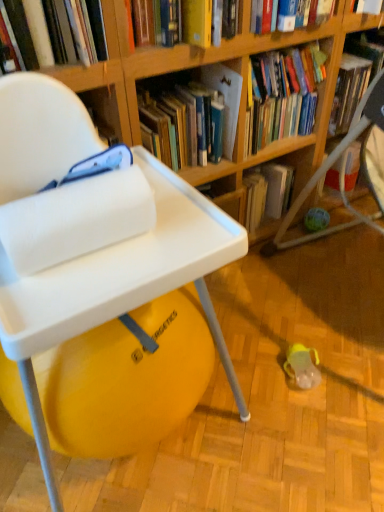
You are a GUI agent. You are given a task and a screenshot of the screen. Output one action in this format:
    pyautogui.click(x=<x>, y=<y>)
    Task: Click on the wooden bookshelf at center, which appears as the second shelf when viewed from the front
    
    Given the screenshot: What is the action you would take?
    pyautogui.click(x=278, y=189)

I want to click on hardcover book at upper center, arranged as the first book when viewed from the right, so click(x=205, y=22).

Describe the element at coordinates (155, 72) in the screenshot. This screenshot has width=384, height=512. I see `wooden bookshelf at upper center, the 2th shelf when ordered from right to left` at that location.

Locate an element on the screen. The width and height of the screenshot is (384, 512). wooden bookshelf at center, the 1th shelf viewed from the back is located at coordinates (278, 189).

Does hardcover book at upper left, which appears as the 3th book when viewed from the right, have a lesser width compared to wooden bookshelf at upper center, the 1th shelf positioned from the front?

In fact, hardcover book at upper left, which appears as the 3th book when viewed from the right, might be wider than wooden bookshelf at upper center, the 1th shelf positioned from the front.

Which object is closer to the camera, hardcover book at upper left, which appears as the 3th book when viewed from the right, or wooden bookshelf at upper center, positioned as the 2th shelf in back-to-front order?

hardcover book at upper left, which appears as the 3th book when viewed from the right, is in front.

Are hardcover book at upper left, which appears as the 3th book when viewed from the right, and wooden bookshelf at upper center, the first shelf viewed from the left, far apart?

No, hardcover book at upper left, which appears as the 3th book when viewed from the right, is in close proximity to wooden bookshelf at upper center, the first shelf viewed from the left.

Is point (99, 23) more distant than point (133, 106)?

No, it is not.

Which object is positioned more to the right, hardcover book at upper center, marked as the 2th book in a right-to-left arrangement, or wooden bookshelf at center, the 1th shelf viewed from the back?

wooden bookshelf at center, the 1th shelf viewed from the back.

Considering the relative sizes of hardcover book at upper center, the second book from the left, and wooden bookshelf at center, the 1th shelf viewed from the back, in the image provided, is hardcover book at upper center, the second book from the left, bigger than wooden bookshelf at center, the 1th shelf viewed from the back,?

Correct, hardcover book at upper center, the second book from the left, is larger in size than wooden bookshelf at center, the 1th shelf viewed from the back.

Is hardcover book at upper center, marked as the 2th book in a right-to-left arrangement, far from wooden bookshelf at center, the 1th shelf viewed from the back?

No, hardcover book at upper center, marked as the 2th book in a right-to-left arrangement, is in close proximity to wooden bookshelf at center, the 1th shelf viewed from the back.

Which is nearer, (267, 86) or (295, 194)?

Clearly, point (267, 86) is closer to the camera than point (295, 194).

Is hardcover book at upper center, marked as the 2th book in a right-to-left arrangement, not inside wooden bookshelf at upper center, positioned as the 2th shelf in back-to-front order?

Absolutely, hardcover book at upper center, marked as the 2th book in a right-to-left arrangement, is external to wooden bookshelf at upper center, positioned as the 2th shelf in back-to-front order.

From a real-world perspective, which is physically above, hardcover book at upper center, marked as the 2th book in a right-to-left arrangement, or wooden bookshelf at upper center, the first shelf viewed from the left?

wooden bookshelf at upper center, the first shelf viewed from the left, from a real-world perspective.

Considering the sizes of hardcover book at upper center, the second book from the left, and wooden bookshelf at upper center, positioned as the 2th shelf in back-to-front order, in the image, is hardcover book at upper center, the second book from the left, wider or thinner than wooden bookshelf at upper center, positioned as the 2th shelf in back-to-front order,?

Considering their sizes, hardcover book at upper center, the second book from the left, looks broader than wooden bookshelf at upper center, positioned as the 2th shelf in back-to-front order.

From a real-world perspective, is hardcover book at upper center, arranged as the third book when viewed from the left, positioned above or below wooden bookshelf at upper center, the first shelf viewed from the left?

Clearly, from a real-world perspective, hardcover book at upper center, arranged as the third book when viewed from the left, is above wooden bookshelf at upper center, the first shelf viewed from the left.

From the image's perspective, which is above, hardcover book at upper center, arranged as the third book when viewed from the left, or wooden bookshelf at upper center, the 2th shelf when ordered from right to left?

hardcover book at upper center, arranged as the third book when viewed from the left, is shown above in the image.

Which object is positioned more to the left, hardcover book at upper center, arranged as the first book when viewed from the right, or wooden bookshelf at upper center, positioned as the 2th shelf in back-to-front order?

From the viewer's perspective, wooden bookshelf at upper center, positioned as the 2th shelf in back-to-front order, appears more on the left side.

Based on the photo, who is shorter, hardcover book at upper center, arranged as the third book when viewed from the left, or wooden bookshelf at upper center, the 2th shelf when ordered from right to left?

Standing shorter between the two is hardcover book at upper center, arranged as the third book when viewed from the left.

From the picture: Is white plastic chair at left placed right next to hardcover book at upper left, which appears as the 3th book when viewed from the right?

No, white plastic chair at left is not making contact with hardcover book at upper left, which appears as the 3th book when viewed from the right.

Is white plastic chair at left looking in the opposite direction of hardcover book at upper left, which appears as the 3th book when viewed from the right?

white plastic chair at left does not have its back to hardcover book at upper left, which appears as the 3th book when viewed from the right.

Is white plastic chair at left at the right side of hardcover book at upper left, which appears as the 3th book when viewed from the right?

Yes, white plastic chair at left is to the right of hardcover book at upper left, which appears as the 3th book when viewed from the right.

From the picture: From the image's perspective, is white plastic chair at left above or below hardcover book at upper left, which is counted as the first book, starting from the left?

Clearly, from the image's perspective, white plastic chair at left is below hardcover book at upper left, which is counted as the first book, starting from the left.

Is hardcover book at upper left, which appears as the 3th book when viewed from the right, wider than hardcover book at upper center, arranged as the third book when viewed from the left?

No, hardcover book at upper left, which appears as the 3th book when viewed from the right, is not wider than hardcover book at upper center, arranged as the third book when viewed from the left.

From the image's perspective, which one is positioned higher, hardcover book at upper left, which is counted as the first book, starting from the left, or hardcover book at upper center, arranged as the first book when viewed from the right?

hardcover book at upper center, arranged as the first book when viewed from the right, from the image's perspective.

Relative to hardcover book at upper center, arranged as the third book when viewed from the left, is hardcover book at upper left, which appears as the 3th book when viewed from the right, in front or behind?

hardcover book at upper left, which appears as the 3th book when viewed from the right, is in front of hardcover book at upper center, arranged as the third book when viewed from the left.

From the image's perspective, which object appears higher, hardcover book at upper left, which is counted as the first book, starting from the left, or wooden bookshelf at center, placed as the 2th shelf when sorted from left to right?

hardcover book at upper left, which is counted as the first book, starting from the left.

Would you say hardcover book at upper left, which is counted as the first book, starting from the left, is inside or outside wooden bookshelf at center, the 1th shelf viewed from the back?

hardcover book at upper left, which is counted as the first book, starting from the left, is outside wooden bookshelf at center, the 1th shelf viewed from the back.

Which of these two, hardcover book at upper left, which is counted as the first book, starting from the left, or wooden bookshelf at center, the 1th shelf viewed from the back, is bigger?

With larger size is wooden bookshelf at center, the 1th shelf viewed from the back.

From the hardcover book at upper left, which is counted as the first book, starting from the left, count 1st shelf to the right and point to it. Please provide its 2D coordinates.

[(155, 72)]

Find the location of a particular element. This screenshot has height=512, width=384. the 1st book in front of the wooden bookshelf at center, positioned as the first shelf in right-to-left order, starting your count from the anchor is located at coordinates tap(283, 95).

Based on their spatial positions, is wooden bookshelf at center, positioned as the first shelf in right-to-left order, or white plastic chair at left closer to hardcover book at upper center, arranged as the third book when viewed from the left?

white plastic chair at left lies closer to hardcover book at upper center, arranged as the third book when viewed from the left, than the other object.

Looking at the image, which one is located closer to wooden bookshelf at center, positioned as the first shelf in right-to-left order, hardcover book at upper center, the second book from the left, or hardcover book at upper center, arranged as the first book when viewed from the right?

The object closer to wooden bookshelf at center, positioned as the first shelf in right-to-left order, is hardcover book at upper center, the second book from the left.

From the image, which object appears to be nearer to hardcover book at upper center, marked as the 2th book in a right-to-left arrangement, hardcover book at upper center, arranged as the first book when viewed from the right, or white plastic chair at left?

hardcover book at upper center, arranged as the first book when viewed from the right, is closer to hardcover book at upper center, marked as the 2th book in a right-to-left arrangement.

Which object lies nearer to the anchor point wooden bookshelf at center, which appears as the second shelf when viewed from the front, white plastic chair at left or hardcover book at upper center, the second book from the left?

hardcover book at upper center, the second book from the left, is closer to wooden bookshelf at center, which appears as the second shelf when viewed from the front.

Looking at the image, which one is located closer to wooden bookshelf at upper center, positioned as the 2th shelf in back-to-front order, hardcover book at upper center, the second book from the left, or hardcover book at upper left, which appears as the 3th book when viewed from the right?

hardcover book at upper center, the second book from the left, is closer to wooden bookshelf at upper center, positioned as the 2th shelf in back-to-front order.

From the image, which object appears to be nearer to hardcover book at upper center, arranged as the third book when viewed from the left, wooden bookshelf at upper center, the first shelf viewed from the left, or white plastic chair at left?

wooden bookshelf at upper center, the first shelf viewed from the left, is positioned closer to the anchor hardcover book at upper center, arranged as the third book when viewed from the left.

Which object lies further to the anchor point hardcover book at upper left, which is counted as the first book, starting from the left, wooden bookshelf at center, positioned as the first shelf in right-to-left order, or white plastic chair at left?

wooden bookshelf at center, positioned as the first shelf in right-to-left order.

Estimate the real-world distances between objects in this image. Which object is closer to wooden bookshelf at upper center, positioned as the 2th shelf in back-to-front order, wooden bookshelf at center, positioned as the first shelf in right-to-left order, or hardcover book at upper center, arranged as the first book when viewed from the right?

hardcover book at upper center, arranged as the first book when viewed from the right, is closer to wooden bookshelf at upper center, positioned as the 2th shelf in back-to-front order.

The height and width of the screenshot is (512, 384). Find the location of `book between wooden bookshelf at upper center, the 2th shelf when ordered from right to left, and hardcover book at upper center, arranged as the first book when viewed from the right, in the horizontal direction`. book between wooden bookshelf at upper center, the 2th shelf when ordered from right to left, and hardcover book at upper center, arranged as the first book when viewed from the right, in the horizontal direction is located at coordinates (283, 95).

At what (x,y) coordinates should I click in order to perform the action: click on shelf between hardcover book at upper left, which is counted as the first book, starting from the left, and hardcover book at upper center, arranged as the first book when viewed from the right. Please return your answer as a coordinate pair (x, y). Looking at the image, I should click on (155, 72).

This screenshot has width=384, height=512. In order to click on book between hardcover book at upper center, the second book from the left, and white plastic chair at left from top to bottom in this screenshot , I will do `click(57, 31)`.

The height and width of the screenshot is (512, 384). I want to click on shelf located between hardcover book at upper left, which appears as the 3th book when viewed from the right, and hardcover book at upper center, the second book from the left, in the left-right direction, so click(155, 72).